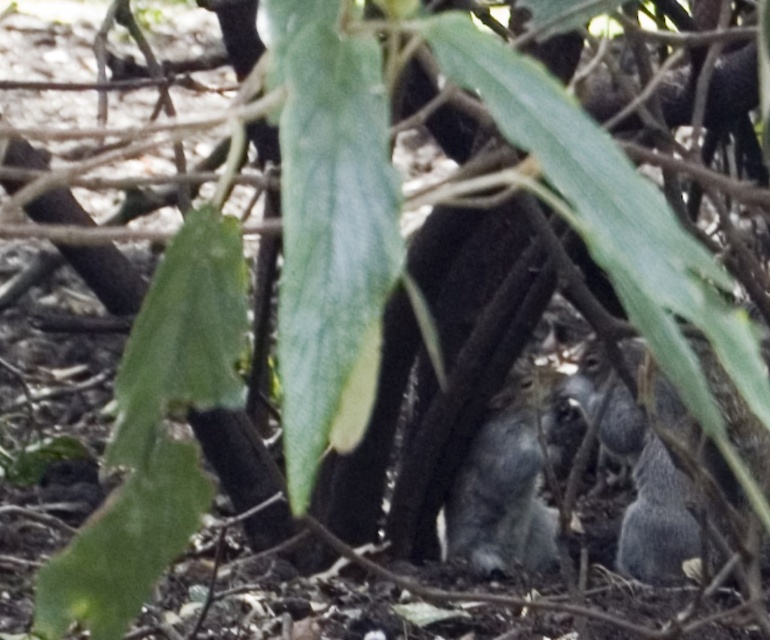
In the scene shown: You are a wildlife photographer aiming to capture both the gray furry squirrel at lower right and the gray furry squirrel at center in a single frame. Which squirrel should you focus on first to ensure both are in the frame without moving the camera?

You should focus on the gray furry squirrel at lower right first because it is bigger and will require more attention to ensure it fits well in the frame while still capturing the smaller gray furry squirrel at center.

You are a wildlife photographer aiming to capture both the gray furry squirrel at lower right and the gray furry squirrel at center in a single frame. Based on their sizes, which squirrel will appear closer to the camera in your photo?

The gray furry squirrel at lower right will appear closer to the camera because it is larger in size compared to the gray furry squirrel at center.